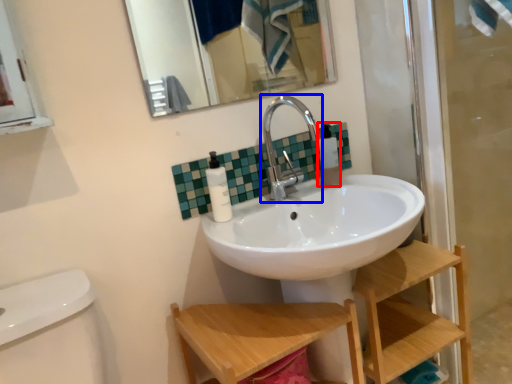
Question: Which point is further to the camera, toiletry (highlighted by a red box) or tap (highlighted by a blue box)?

Choices:
 (A) toiletry
 (B) tap

Answer: (A)